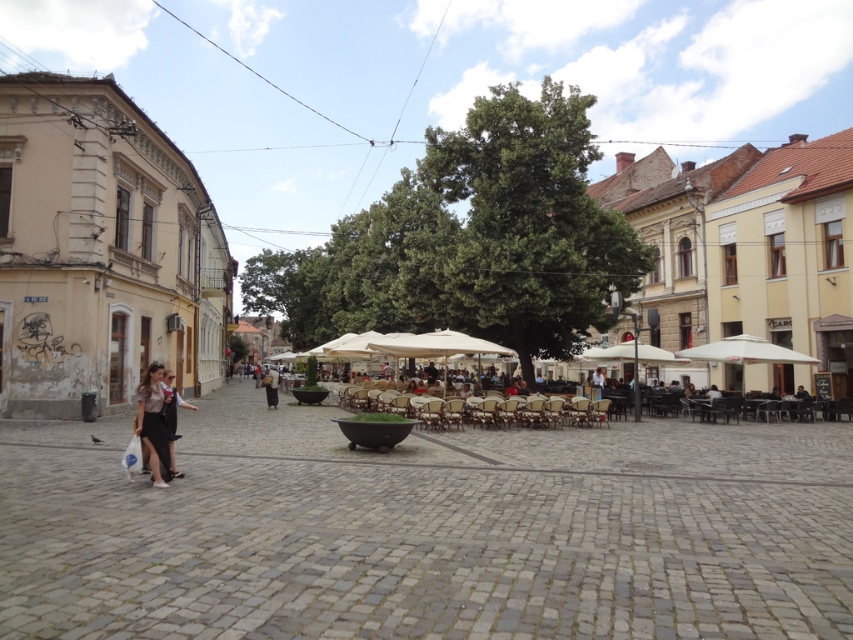
In the scene shown: You are a tourist visiting the square and want to take a photo of both the white fabric umbrella at center and the dark brown leather jacket at center. Which object should you focus on first to ensure both are in the frame?

You should focus on the white fabric umbrella at center first since it is closer to you than the dark brown leather jacket at center, ensuring both are in the frame.